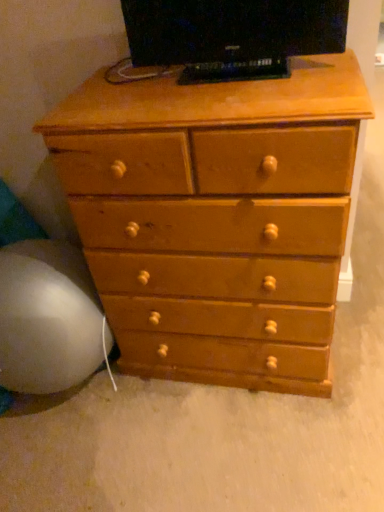
Question: Is light brown wood chest of drawers at center inside matte black tv at upper center?

Choices:
 (A) no
 (B) yes

Answer: (A)

Question: From a real-world perspective, is matte black tv at upper center physically above light brown wood chest of drawers at center?

Choices:
 (A) yes
 (B) no

Answer: (A)

Question: Is matte black tv at upper center positioned beyond the bounds of light brown wood chest of drawers at center?

Choices:
 (A) yes
 (B) no

Answer: (A)

Question: Considering the relative positions of matte black tv at upper center and light brown wood chest of drawers at center in the image provided, is matte black tv at upper center in front of light brown wood chest of drawers at center?

Choices:
 (A) yes
 (B) no

Answer: (B)

Question: Considering the relative positions of matte black tv at upper center and light brown wood chest of drawers at center in the image provided, is matte black tv at upper center to the left of light brown wood chest of drawers at center from the viewer's perspective?

Choices:
 (A) yes
 (B) no

Answer: (B)

Question: Looking at their shapes, would you say matte black tv at upper center is wider or thinner than white fabric bean bag at lower left?

Choices:
 (A) wide
 (B) thin

Answer: (B)

Question: Based on their positions, is matte black tv at upper center located to the left or right of white fabric bean bag at lower left?

Choices:
 (A) right
 (B) left

Answer: (A)

Question: Is matte black tv at upper center in front of or behind white fabric bean bag at lower left in the image?

Choices:
 (A) behind
 (B) front

Answer: (B)

Question: Looking at the image, does matte black tv at upper center seem bigger or smaller compared to white fabric bean bag at lower left?

Choices:
 (A) small
 (B) big

Answer: (A)

Question: Looking at the image, does light brown wood chest of drawers at center seem bigger or smaller compared to matte black tv at upper center?

Choices:
 (A) small
 (B) big

Answer: (B)

Question: Is light brown wood chest of drawers at center spatially inside matte black tv at upper center, or outside of it?

Choices:
 (A) inside
 (B) outside

Answer: (B)

Question: From the image's perspective, relative to matte black tv at upper center, is light brown wood chest of drawers at center above or below?

Choices:
 (A) above
 (B) below

Answer: (B)

Question: Considering the positions of point (135, 293) and point (286, 57), is point (135, 293) closer or farther from the camera than point (286, 57)?

Choices:
 (A) farther
 (B) closer

Answer: (A)

Question: Based on their sizes in the image, would you say matte black tv at upper center is bigger or smaller than light brown wood chest of drawers at center?

Choices:
 (A) big
 (B) small

Answer: (B)

Question: In terms of width, does matte black tv at upper center look wider or thinner when compared to light brown wood chest of drawers at center?

Choices:
 (A) thin
 (B) wide

Answer: (A)